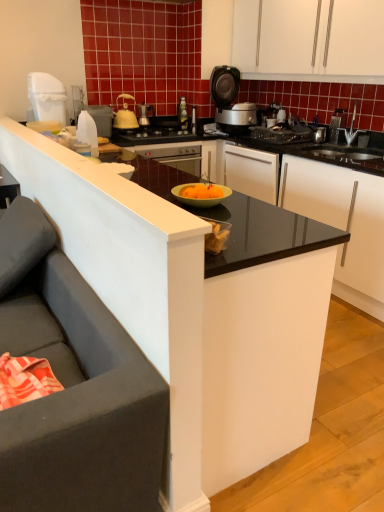
Question: Is white matte cabinet at upper center at the right side of white plastic trash can at upper left, which ranks as the fourth kitchen appliance in right-to-left order?

Choices:
 (A) yes
 (B) no

Answer: (A)

Question: Is white matte cabinet at upper center facing towards white plastic trash can at upper left, the first kitchen appliance from the left?

Choices:
 (A) yes
 (B) no

Answer: (A)

Question: From a real-world perspective, is white matte cabinet at upper center below white plastic trash can at upper left, acting as the 2th kitchen appliance starting from the front?

Choices:
 (A) no
 (B) yes

Answer: (A)

Question: Is white matte cabinet at upper center next to white plastic trash can at upper left, the first kitchen appliance from the left, and touching it?

Choices:
 (A) yes
 (B) no

Answer: (B)

Question: From the image's perspective, is white matte cabinet at upper center below white plastic trash can at upper left, which is the third kitchen appliance in back-to-front order?

Choices:
 (A) no
 (B) yes

Answer: (A)

Question: Considering the relative positions of white matte cabinet at upper center and white plastic trash can at upper left, which ranks as the fourth kitchen appliance in right-to-left order, in the image provided, is white matte cabinet at upper center to the left of white plastic trash can at upper left, which ranks as the fourth kitchen appliance in right-to-left order, from the viewer's perspective?

Choices:
 (A) no
 (B) yes

Answer: (A)

Question: Is yellow matte kettle at upper center, the 3th kitchen appliance when ordered from left to right, not within matte black rice cooker at upper center?

Choices:
 (A) no
 (B) yes

Answer: (B)

Question: Does yellow matte kettle at upper center, which ranks as the 2th kitchen appliance in right-to-left order, have a lesser height compared to matte black rice cooker at upper center?

Choices:
 (A) yes
 (B) no

Answer: (A)

Question: Is yellow matte kettle at upper center, acting as the 3th kitchen appliance starting from the front, taller than matte black rice cooker at upper center?

Choices:
 (A) yes
 (B) no

Answer: (B)

Question: Considering the relative positions of yellow matte kettle at upper center, the 2th kitchen appliance positioned from the back, and matte black rice cooker at upper center in the image provided, is yellow matte kettle at upper center, the 2th kitchen appliance positioned from the back, to the right of matte black rice cooker at upper center from the viewer's perspective?

Choices:
 (A) yes
 (B) no

Answer: (B)

Question: From a real-world perspective, is yellow matte kettle at upper center, which ranks as the 2th kitchen appliance in right-to-left order, physically above matte black rice cooker at upper center?

Choices:
 (A) yes
 (B) no

Answer: (B)

Question: From the image's perspective, is yellow matte kettle at upper center, acting as the 3th kitchen appliance starting from the front, over matte black rice cooker at upper center?

Choices:
 (A) yes
 (B) no

Answer: (B)

Question: Is white plastic bottle at left, arranged as the 2th kitchen appliance when viewed from the left, shorter than white plastic trash can at upper left, which ranks as the fourth kitchen appliance in right-to-left order?

Choices:
 (A) no
 (B) yes

Answer: (B)